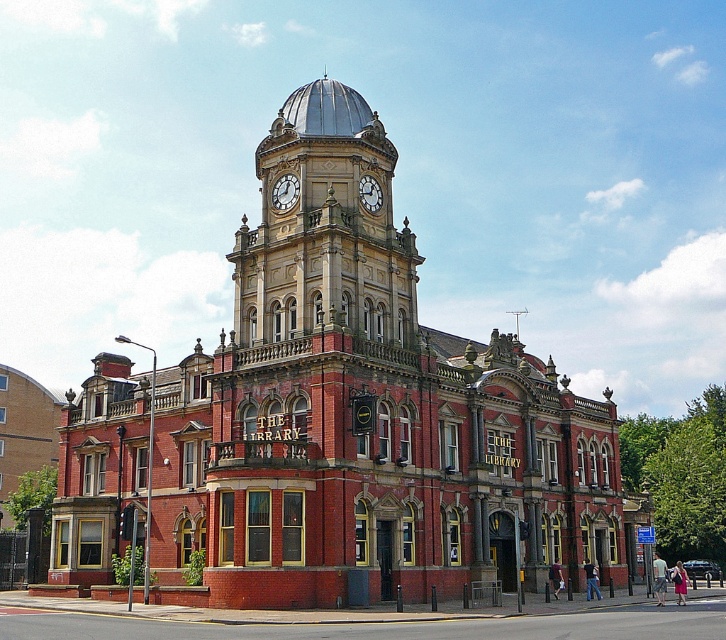
Question: Can you confirm if polished brass clock tower at upper center is wider than gold metallic clock at upper center?

Choices:
 (A) no
 (B) yes

Answer: (B)

Question: Among these objects, which one is farthest from the camera?

Choices:
 (A) white painted metal clock at upper center
 (B) polished brass clock tower at upper center

Answer: (A)

Question: From the image, what is the correct spatial relationship of polished brass clock tower at upper center in relation to gold metallic clock at upper center?

Choices:
 (A) below
 (B) above

Answer: (A)

Question: Which of the following is the closest to the observer?

Choices:
 (A) (285, 204)
 (B) (399, 234)

Answer: (A)

Question: Does polished brass clock tower at upper center come in front of gold metallic clock at upper center?

Choices:
 (A) no
 (B) yes

Answer: (B)

Question: Among these objects, which one is nearest to the camera?

Choices:
 (A) polished brass clock tower at upper center
 (B) white painted metal clock at upper center
 (C) gold metallic clock at upper center

Answer: (A)